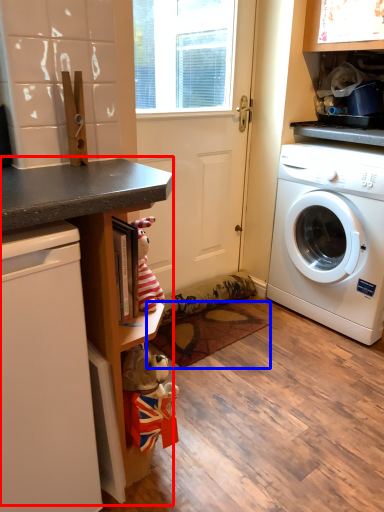
Question: Which of the following is the closest to the observer, counter (highlighted by a red box) or mat (highlighted by a blue box)?

Choices:
 (A) counter
 (B) mat

Answer: (A)